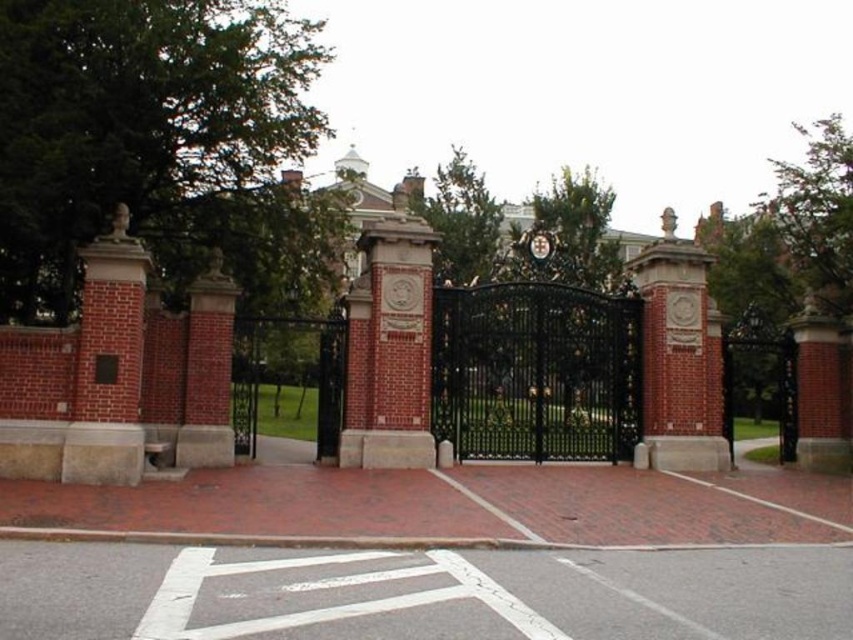
Does black wrought iron gate at center appear over metallic clock at center?

Incorrect, black wrought iron gate at center is not positioned above metallic clock at center.

Is point (538, 321) positioned in front of point (532, 252)?

Yes, point (538, 321) is closer to viewer.

Find the location of a particular element. black wrought iron gate at center is located at coordinates (537, 372).